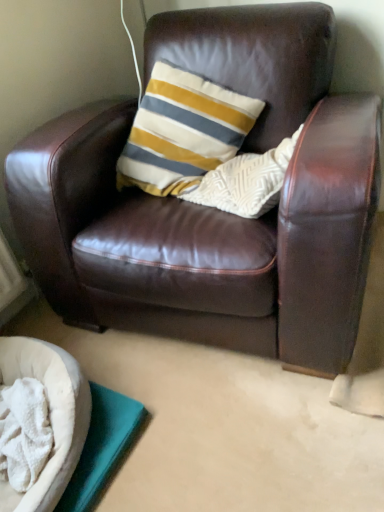
Question: Is brown leather chair at center looking in the opposite direction of white soft dog bed at lower left?

Choices:
 (A) no
 (B) yes

Answer: (A)

Question: Can you confirm if brown leather chair at center is shorter than white soft dog bed at lower left?

Choices:
 (A) yes
 (B) no

Answer: (B)

Question: Does brown leather chair at center have a greater height compared to white soft dog bed at lower left?

Choices:
 (A) no
 (B) yes

Answer: (B)

Question: Is brown leather chair at center further to the viewer compared to white soft dog bed at lower left?

Choices:
 (A) yes
 (B) no

Answer: (B)

Question: From the image's perspective, is brown leather chair at center below white soft dog bed at lower left?

Choices:
 (A) no
 (B) yes

Answer: (A)

Question: From a real-world perspective, is brown leather chair at center under white soft dog bed at lower left?

Choices:
 (A) yes
 (B) no

Answer: (B)

Question: From the image's perspective, is white soft dog bed at lower left beneath brown leather chair at center?

Choices:
 (A) yes
 (B) no

Answer: (A)

Question: Is white soft dog bed at lower left not near brown leather chair at center?

Choices:
 (A) no
 (B) yes

Answer: (A)

Question: From a real-world perspective, is white soft dog bed at lower left on top of brown leather chair at center?

Choices:
 (A) yes
 (B) no

Answer: (B)

Question: Is white soft dog bed at lower left completely or partially outside of brown leather chair at center?

Choices:
 (A) yes
 (B) no

Answer: (A)

Question: Could you tell me if white soft dog bed at lower left is facing brown leather chair at center?

Choices:
 (A) no
 (B) yes

Answer: (A)

Question: From a real-world perspective, is white soft dog bed at lower left below brown leather chair at center?

Choices:
 (A) yes
 (B) no

Answer: (A)

Question: Considering the relative positions of brown leather chair at center and white soft dog bed at lower left in the image provided, is brown leather chair at center to the left or to the right of white soft dog bed at lower left?

Choices:
 (A) right
 (B) left

Answer: (A)